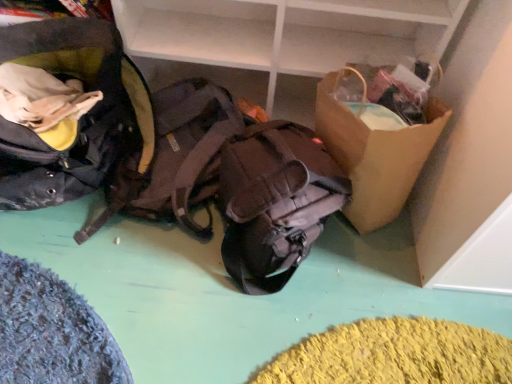
Question: Which direction should I rotate to look at brown fabric backpack at center, positioned as the 2th backpack in right-to-left order?

Choices:
 (A) left
 (B) right

Answer: (A)

Question: Considering the relative sizes of brown fabric backpack at center, positioned as the 2th backpack in right-to-left order, and matte brown backpack at center, the third backpack in the left-to-right sequence, in the image provided, is brown fabric backpack at center, positioned as the 2th backpack in right-to-left order, thinner than matte brown backpack at center, the third backpack in the left-to-right sequence,?

Choices:
 (A) no
 (B) yes

Answer: (A)

Question: Can you confirm if brown fabric backpack at center, which is the 2th backpack in left-to-right order, is positioned to the left of matte brown backpack at center, the 1th backpack viewed from the right?

Choices:
 (A) yes
 (B) no

Answer: (A)

Question: Is brown fabric backpack at center, which is the 2th backpack in left-to-right order, looking in the opposite direction of matte brown backpack at center, the third backpack in the left-to-right sequence?

Choices:
 (A) no
 (B) yes

Answer: (A)

Question: Is brown fabric backpack at center, positioned as the 2th backpack in right-to-left order, directly adjacent to matte brown backpack at center, the 1th backpack viewed from the right?

Choices:
 (A) yes
 (B) no

Answer: (B)

Question: From the image's perspective, does brown fabric backpack at center, which is the 2th backpack in left-to-right order, appear higher than matte brown backpack at center, the 1th backpack viewed from the right?

Choices:
 (A) no
 (B) yes

Answer: (B)

Question: Is brown fabric backpack at center, positioned as the 2th backpack in right-to-left order, further to camera compared to matte brown backpack at center, the 1th backpack viewed from the right?

Choices:
 (A) no
 (B) yes

Answer: (B)

Question: From the image's perspective, is matte black backpack at left, placed as the first backpack when sorted from left to right, under brown fabric backpack at center, which is the 2th backpack in left-to-right order?

Choices:
 (A) no
 (B) yes

Answer: (A)

Question: Considering the relative sizes of matte black backpack at left, positioned as the 3th backpack in right-to-left order, and brown fabric backpack at center, positioned as the 2th backpack in right-to-left order, in the image provided, is matte black backpack at left, positioned as the 3th backpack in right-to-left order, shorter than brown fabric backpack at center, positioned as the 2th backpack in right-to-left order,?

Choices:
 (A) yes
 (B) no

Answer: (B)

Question: Could brown fabric backpack at center, which is the 2th backpack in left-to-right order, be considered to be inside matte black backpack at left, placed as the first backpack when sorted from left to right?

Choices:
 (A) yes
 (B) no

Answer: (B)

Question: From the image's perspective, would you say matte black backpack at left, placed as the first backpack when sorted from left to right, is positioned over brown fabric backpack at center, which is the 2th backpack in left-to-right order?

Choices:
 (A) yes
 (B) no

Answer: (A)

Question: Is matte black backpack at left, placed as the first backpack when sorted from left to right, taller than brown fabric backpack at center, positioned as the 2th backpack in right-to-left order?

Choices:
 (A) no
 (B) yes

Answer: (B)

Question: Considering the relative positions of matte black backpack at left, positioned as the 3th backpack in right-to-left order, and brown fabric backpack at center, positioned as the 2th backpack in right-to-left order, in the image provided, is matte black backpack at left, positioned as the 3th backpack in right-to-left order, to the right of brown fabric backpack at center, positioned as the 2th backpack in right-to-left order, from the viewer's perspective?

Choices:
 (A) no
 (B) yes

Answer: (A)

Question: Is matte brown backpack at center, the third backpack in the left-to-right sequence, next to brown paper bag at right and touching it?

Choices:
 (A) yes
 (B) no

Answer: (B)